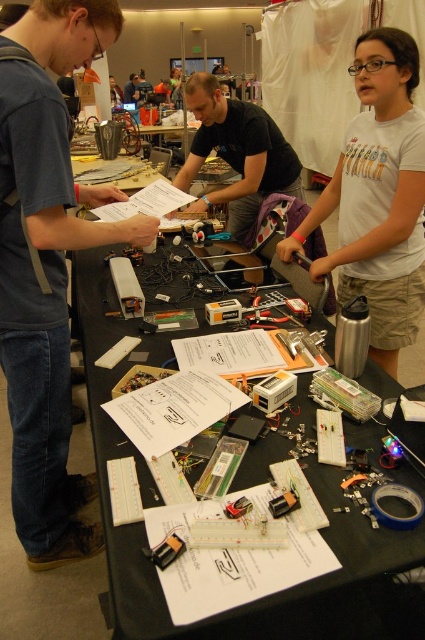
You are organizing a workshop and need to place a large poster on the table. Considering the black plastic table at center and the black matte shirt at center, which object can you place the poster on?

The black plastic table at center is a surface and can hold the poster, while the black matte shirt at center is likely clothing and not suitable for placing items on.

You are organizing a workshop and need to place a large project kit on the table. Given that the black plastic table at center and the black matte shirt at center are both at the center, which one can accommodate the kit better?

The black plastic table at center has a larger size compared to the black matte shirt at center, so it can accommodate the large project kit better.